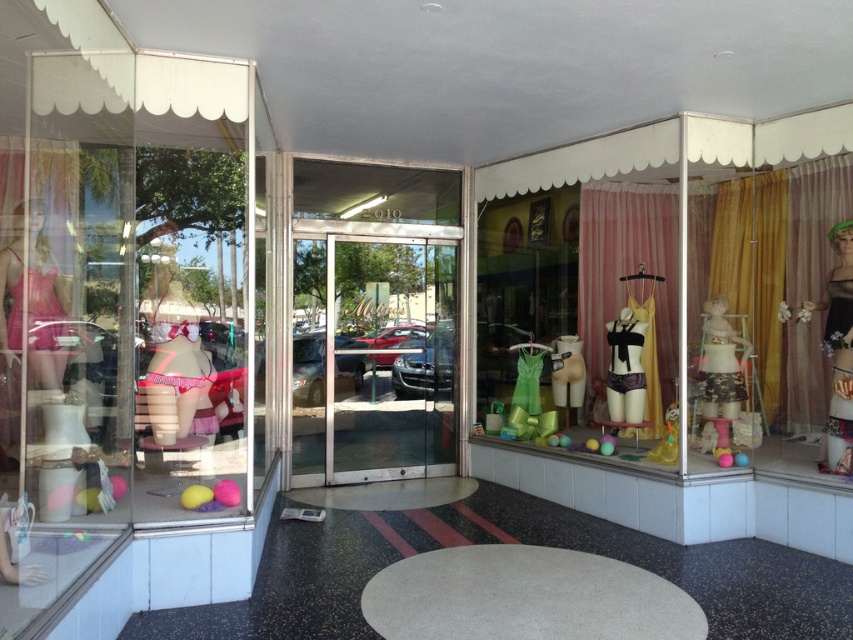
Question: Which of the following is the closest to the observer?

Choices:
 (A) purple satin lingerie at center
 (B) clear glass door at center
 (C) shiny black dress at right
 (D) gold fabric curtain at right

Answer: (C)

Question: Does clear glass door at center appear on the right side of matte pink doll at center?

Choices:
 (A) yes
 (B) no

Answer: (B)

Question: Can you confirm if clear glass door at center is smaller than purple satin lingerie at center?

Choices:
 (A) yes
 (B) no

Answer: (B)

Question: Which object is farther from the camera taking this photo?

Choices:
 (A) clear glass door at center
 (B) matte pink doll at center

Answer: (A)

Question: In this image, where is clear glass door at center located relative to matte pink doll at center?

Choices:
 (A) below
 (B) above

Answer: (A)

Question: Based on their relative distances, which object is farther from the purple satin lingerie at center?

Choices:
 (A) matte pink doll at center
 (B) shiny black dress at right
 (C) gold fabric curtain at right

Answer: (C)